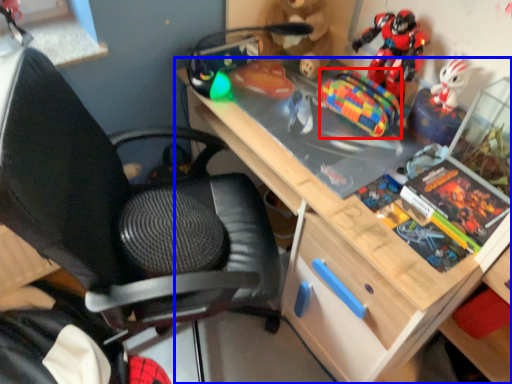
Question: Which object appears farthest to the camera in this image, toy (highlighted by a red box) or desk (highlighted by a blue box)?

Choices:
 (A) toy
 (B) desk

Answer: (A)